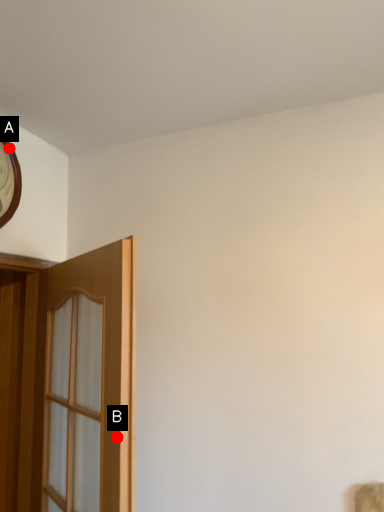
Question: Two points are circled on the image, labeled by A and B beside each circle. Which point is closer to the camera taking this photo?

Choices:
 (A) A is closer
 (B) B is closer

Answer: (B)